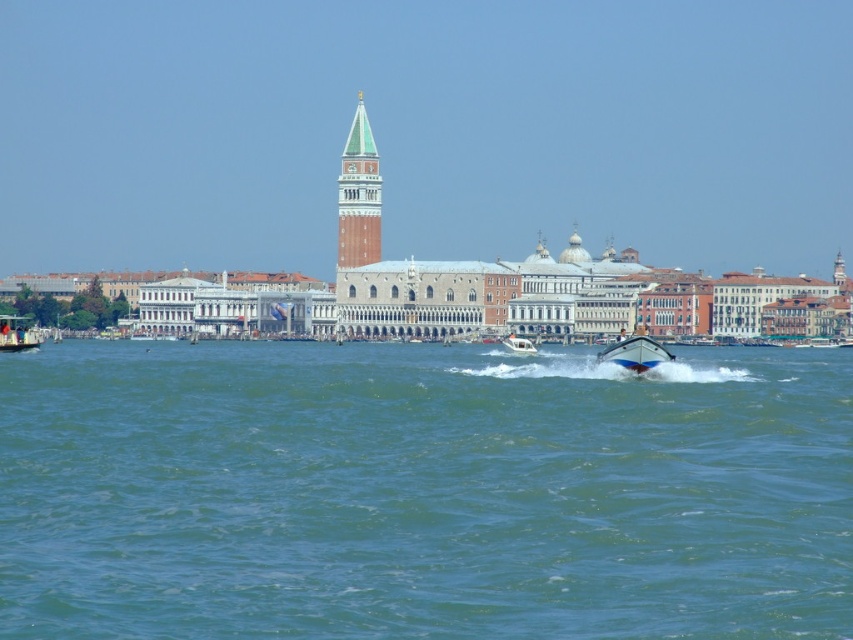
Does blue glossy motorboat at center have a greater width compared to metallic silver boat at lower left?

Incorrect, blue glossy motorboat at center's width does not surpass metallic silver boat at lower left's.

Can you confirm if blue glossy motorboat at center is positioned to the right of metallic silver boat at lower left?

Correct, you'll find blue glossy motorboat at center to the right of metallic silver boat at lower left.

Does point (656, 360) come behind point (28, 330)?

No.

In order to click on blue glossy motorboat at center in this screenshot , I will do `click(635, 353)`.

Who is more forward, (x=12, y=365) or (x=648, y=364)?

Point (x=648, y=364) is more forward.

Which is more to the right, green water at center or blue glossy motorboat at center?

blue glossy motorboat at center is more to the right.

I want to click on green water at center, so click(x=422, y=492).

Where is `green water at center`? green water at center is located at coordinates (422, 492).

Who is more forward, (x=364, y=257) or (x=523, y=348)?

Point (x=523, y=348) is in front.

Who is positioned more to the right, green marble tower at center or white glossy motorboat at center?

From the viewer's perspective, white glossy motorboat at center appears more on the right side.

This screenshot has height=640, width=853. What do you see at coordinates (358, 195) in the screenshot?
I see `green marble tower at center` at bounding box center [358, 195].

Locate an element on the screen. This screenshot has height=640, width=853. green marble tower at center is located at coordinates (358, 195).